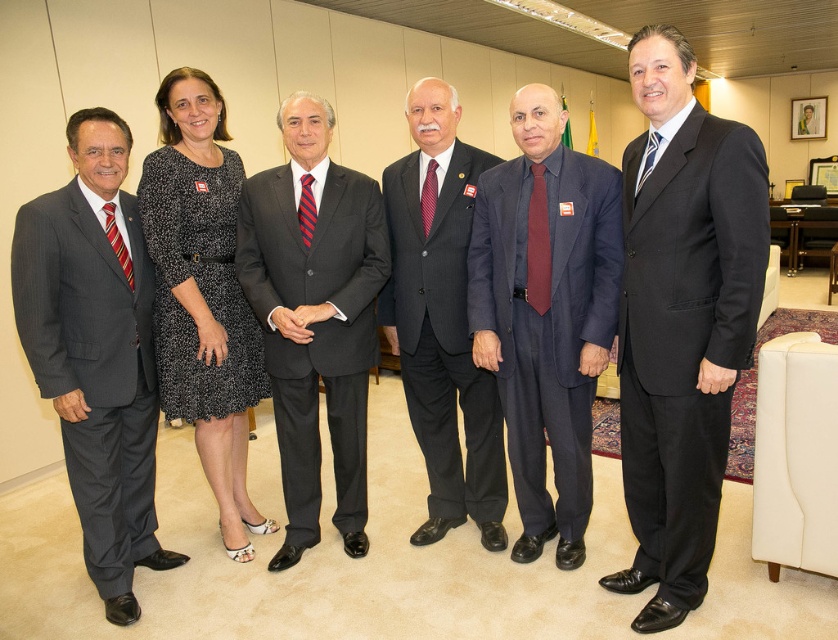
Consider the image. Which is more to the right, matte black suit at left or red striped tie at center?

Positioned to the right is red striped tie at center.

In the scene shown: Is matte black suit at left closer to the viewer compared to red striped tie at center?

Yes, it is.

This screenshot has height=640, width=838. What do you see at coordinates (96, 353) in the screenshot? I see `matte black suit at left` at bounding box center [96, 353].

Find the location of a particular element. matte black suit at left is located at coordinates (96, 353).

Can you confirm if red striped tie at center is wider than red silk tie at center?

Incorrect, red striped tie at center's width does not surpass red silk tie at center's.

Where is `red striped tie at center`? The image size is (838, 640). red striped tie at center is located at coordinates (306, 209).

Is point (282, 262) behind point (647, 164)?

Yes, point (282, 262) is behind point (647, 164).

Does dark gray suit at center lie behind white striped tie at right?

Yes.

Does point (373, 358) come behind point (640, 179)?

Yes, point (373, 358) is farther from viewer.

Image resolution: width=838 pixels, height=640 pixels. I want to click on dark gray suit at center, so click(x=316, y=330).